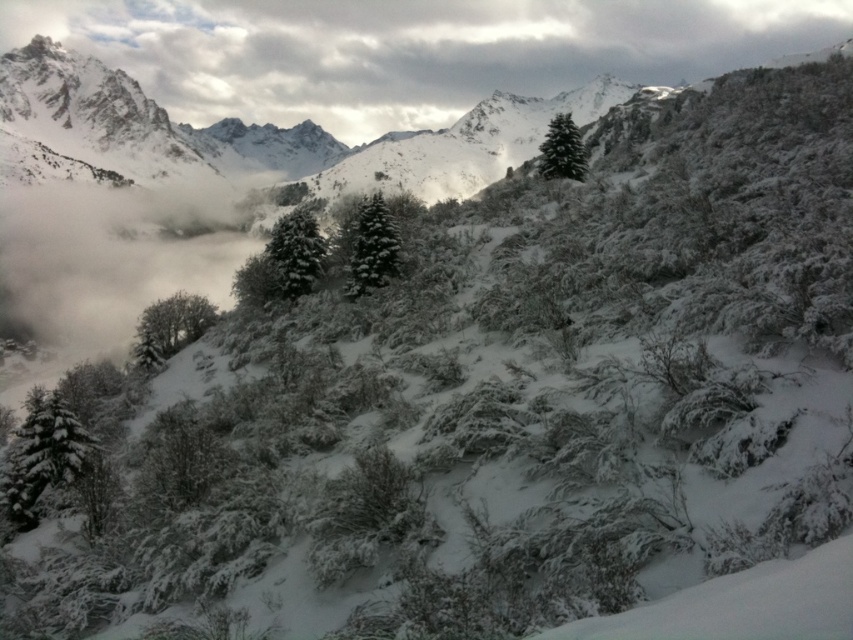
You are standing at the origin point of the coordinate system in the winter landscape. The green matte tree at lower left is marked on the map. Can you determine its exact location based on the coordinate system?

The green matte tree at lower left is located at point (170, 326) according to the coordinate system provided.

You are an observer looking at the winter landscape. You notice the white fluffy cloud at upper center and the green matte evergreen tree at center. Which object appears taller in the image?

The white fluffy cloud at upper center appears taller than the green matte evergreen tree at center according to the description.

Based on the photo, you are a hiker planning to take a photo of the green matte evergreen tree at center and the white fluffy cloud at upper center from a distance. Given that the camera you have can capture objects up to 1000 feet away in the same frame, will both objects be visible in your photo?

The white fluffy cloud at upper center and green matte evergreen tree at center are 1098.97 feet apart, which exceeds the camera range of 1000 feet. Therefore, both objects cannot be captured in the same frame.